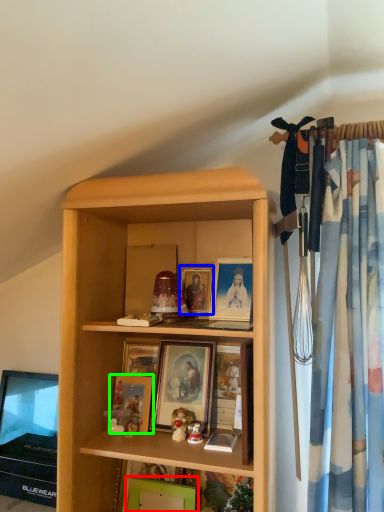
Question: Which object is positioned farthest from picture frame (highlighted by a red box)? Select from picture frame (highlighted by a blue box) and picture frame (highlighted by a green box).

Choices:
 (A) picture frame
 (B) picture frame

Answer: (A)